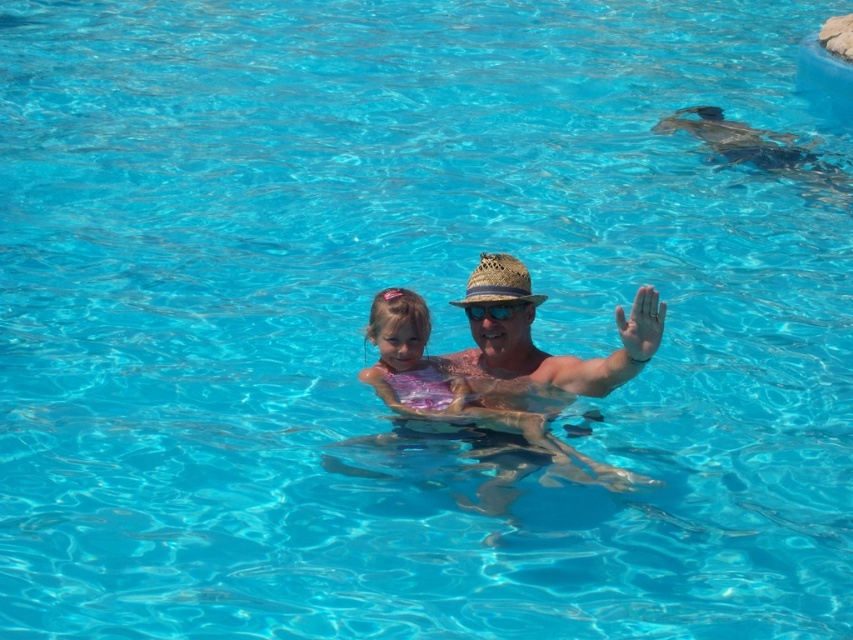
Question: Which of the following is the closest to the observer?

Choices:
 (A) (465, 296)
 (B) (616, 307)
 (C) (492, 316)

Answer: (C)

Question: Which is nearer to the blue reflective plastic goggles at center?

Choices:
 (A) matte straw hat at center
 (B) straw hat at center

Answer: (B)

Question: In this image, where is matte straw hat at center located relative to matte skin palm at upper right?

Choices:
 (A) left
 (B) right

Answer: (A)

Question: Which of these objects is positioned farthest from the straw hat at center?

Choices:
 (A) matte skin palm at upper right
 (B) matte straw hat at center

Answer: (A)

Question: In this image, where is straw hat at center located relative to matte skin palm at upper right?

Choices:
 (A) right
 (B) left

Answer: (B)

Question: Is matte skin palm at upper right thinner than blue reflective plastic goggles at center?

Choices:
 (A) yes
 (B) no

Answer: (A)